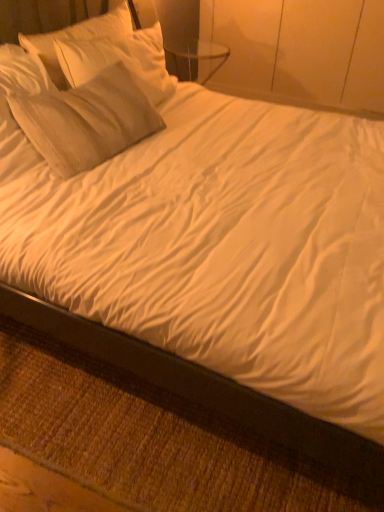
Question: Is point (86, 368) closer or farther from the camera than point (48, 46)?

Choices:
 (A) farther
 (B) closer

Answer: (B)

Question: In terms of size, does black wood bed frame at lower left appear bigger or smaller than white soft pillow at upper left?

Choices:
 (A) big
 (B) small

Answer: (B)

Question: From a real-world perspective, is black wood bed frame at lower left physically located above or below white soft pillow at upper left?

Choices:
 (A) below
 (B) above

Answer: (A)

Question: Visually, is white soft pillow at upper left positioned to the left or to the right of black wood bed frame at lower left?

Choices:
 (A) left
 (B) right

Answer: (A)

Question: Is white soft pillow at upper left taller or shorter than black wood bed frame at lower left?

Choices:
 (A) short
 (B) tall

Answer: (B)

Question: Is point (119, 24) positioned closer to the camera than point (82, 464)?

Choices:
 (A) closer
 (B) farther

Answer: (B)

Question: Relative to black wood bed frame at lower left, is white soft pillow at upper left in front or behind?

Choices:
 (A) behind
 (B) front

Answer: (A)